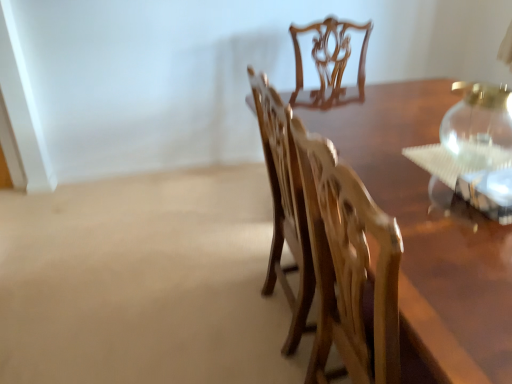
Find the location of a particular element. This screenshot has height=384, width=512. wooden chair at center is located at coordinates (338, 248).

The height and width of the screenshot is (384, 512). What do you see at coordinates (338, 248) in the screenshot?
I see `wooden chair at center` at bounding box center [338, 248].

Locate an element on the screen. transparent glass vase at upper right is located at coordinates (479, 125).

In order to face transparent glass vase at upper right, should I rotate leftwards or rightwards?

Turn right approximately 27.927 degrees to face it.

The width and height of the screenshot is (512, 384). Describe the element at coordinates (479, 125) in the screenshot. I see `transparent glass vase at upper right` at that location.

Locate an element on the screen. The width and height of the screenshot is (512, 384). wooden chair at center is located at coordinates (338, 248).

Can you confirm if transparent glass vase at upper right is positioned to the right of wooden chair at center?

Indeed, transparent glass vase at upper right is positioned on the right side of wooden chair at center.

Who is more distant, transparent glass vase at upper right or wooden chair at center?

transparent glass vase at upper right is behind.

Considering the positions of point (457, 144) and point (352, 371), is point (457, 144) closer or farther from the camera than point (352, 371)?

Point (457, 144) is positioned farther from the camera compared to point (352, 371).

From the image's perspective, which one is positioned higher, transparent glass vase at upper right or wooden chair at center?

transparent glass vase at upper right is shown above in the image.

From a real-world perspective, does transparent glass vase at upper right stand above wooden chair at center?

Yes, from a real-world perspective, transparent glass vase at upper right is over wooden chair at center

Is transparent glass vase at upper right wider than wooden chair at center?

No, transparent glass vase at upper right is not wider than wooden chair at center.

Is transparent glass vase at upper right taller or shorter than wooden chair at center?

In the image, transparent glass vase at upper right appears to be shorter than wooden chair at center.

Who is smaller, transparent glass vase at upper right or wooden chair at center?

transparent glass vase at upper right is smaller.

Choose the correct answer: Is transparent glass vase at upper right inside wooden chair at center or outside it?

transparent glass vase at upper right is not enclosed by wooden chair at center.

Are transparent glass vase at upper right and wooden chair at center located far from each other?

No, there isn't a large distance between transparent glass vase at upper right and wooden chair at center.

Could you tell me if transparent glass vase at upper right is turned towards wooden chair at center?

Yes.

Where is `chair located on the left of transparent glass vase at upper right`? The width and height of the screenshot is (512, 384). chair located on the left of transparent glass vase at upper right is located at coordinates (338, 248).

Considering the relative positions of wooden chair at center and transparent glass vase at upper right in the image provided, is wooden chair at center to the left or to the right of transparent glass vase at upper right?

wooden chair at center is to the left of transparent glass vase at upper right.

Which object is further away from the camera taking this photo, wooden chair at center or transparent glass vase at upper right?

transparent glass vase at upper right is further away from the camera.

Is point (358, 318) in front of point (483, 106)?

Yes.

From the picture: From the image's perspective, which object appears higher, wooden chair at center or transparent glass vase at upper right?

From the image's view, transparent glass vase at upper right is above.

From a real-world perspective, does wooden chair at center stand above transparent glass vase at upper right?

No.

Which of these two, wooden chair at center or transparent glass vase at upper right, is thinner?

Thinner between the two is transparent glass vase at upper right.

Between wooden chair at center and transparent glass vase at upper right, which one has more height?

With more height is wooden chair at center.

Does wooden chair at center have a smaller size compared to transparent glass vase at upper right?

Incorrect, wooden chair at center is not smaller in size than transparent glass vase at upper right.

Could transparent glass vase at upper right be considered to be inside wooden chair at center?

That's incorrect, transparent glass vase at upper right is not inside wooden chair at center.

Is wooden chair at center with transparent glass vase at upper right?

No, wooden chair at center is not in contact with transparent glass vase at upper right.

Is wooden chair at center looking in the opposite direction of transparent glass vase at upper right?

No, wooden chair at center's orientation is not away from transparent glass vase at upper right.

How many degrees apart are the facing directions of wooden chair at center and transparent glass vase at upper right?

177 degrees.

How much distance is there between wooden chair at center and transparent glass vase at upper right?

They are 23.17 inches apart.

I want to click on chair in front of the transparent glass vase at upper right, so click(338, 248).

Identify the location of glass vase to the right of wooden chair at center. (479, 125).

You are a GUI agent. You are given a task and a screenshot of the screen. Output one action in this format:
    pyautogui.click(x=<x>, y=<y>)
    Task: Click on the chair that is in front of the transparent glass vase at upper right
    This screenshot has height=384, width=512.
    Given the screenshot: What is the action you would take?
    pyautogui.click(x=338, y=248)